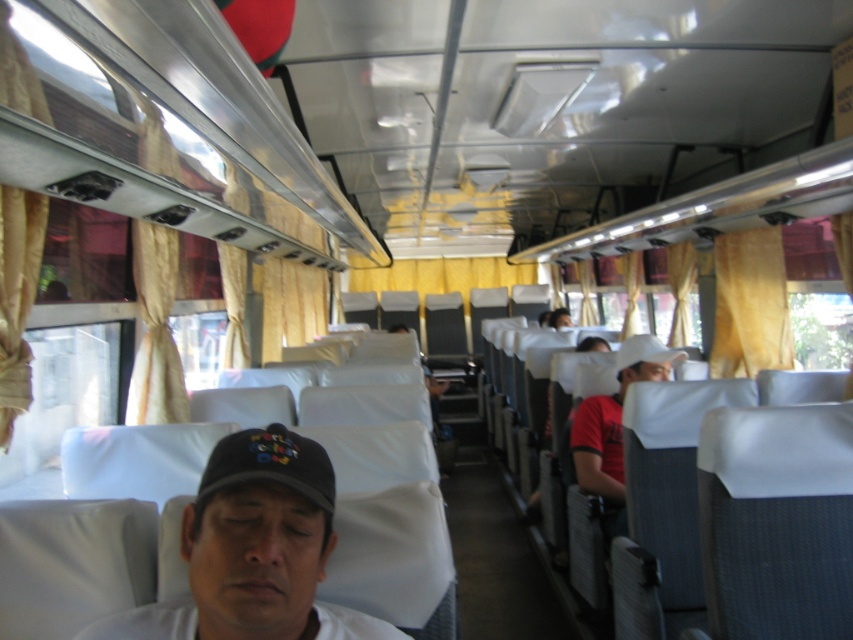
Question: Does white matte cap at center have a larger size compared to white matte baseball cap at center?

Choices:
 (A) no
 (B) yes

Answer: (A)

Question: Among these objects, which one is farthest from the camera?

Choices:
 (A) red matte baseball cap at right
 (B) white matte cap at center
 (C) black fabric baseball cap at center

Answer: (A)

Question: Can you confirm if red matte baseball cap at right is positioned above black fabric baseball cap at center?

Choices:
 (A) no
 (B) yes

Answer: (A)

Question: Which point is closer to the camera?

Choices:
 (A) (280, 472)
 (B) (202, 532)
 (C) (782, 268)

Answer: (A)

Question: Which of the following is the closest to the observer?

Choices:
 (A) red matte baseball cap at right
 (B) white matte cap at center
 (C) white matte baseball cap at center
 (D) yellow fabric curtain at right

Answer: (B)

Question: Can you confirm if red matte baseball cap at right is positioned above white matte baseball cap at center?

Choices:
 (A) no
 (B) yes

Answer: (A)